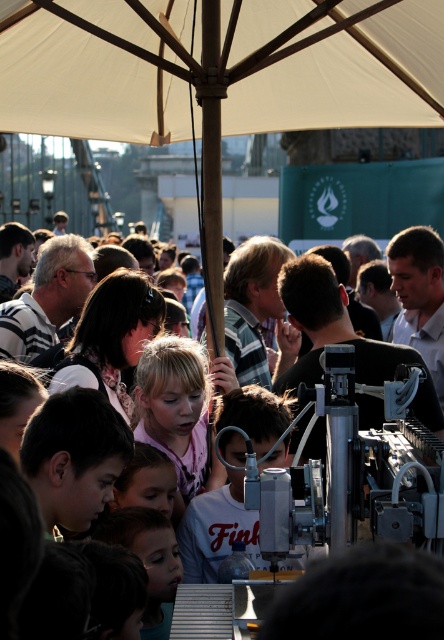
Question: Does white fabric canopy at upper center appear over white matte shirt at center?

Choices:
 (A) yes
 (B) no

Answer: (A)

Question: Does white matte shirt at center lie in front of blonde hair at center?

Choices:
 (A) no
 (B) yes

Answer: (B)

Question: Estimate the real-world distances between objects in this image. Which object is farther from the blonde hair at center?

Choices:
 (A) white fabric canopy at upper center
 (B) white matte shirt at center
 (C) white fabric umbrella at upper center

Answer: (A)

Question: Which point is farther to the camera?

Choices:
 (A) (199, 552)
 (B) (153, 381)
 (C) (269, 99)
 (D) (381, 49)

Answer: (C)

Question: Which object is positioned closest to the white fabric canopy at upper center?

Choices:
 (A) white fabric umbrella at upper center
 (B) blonde hair at center
 (C) white matte shirt at center

Answer: (A)

Question: Is white fabric umbrella at upper center bigger than blonde hair at center?

Choices:
 (A) yes
 (B) no

Answer: (A)